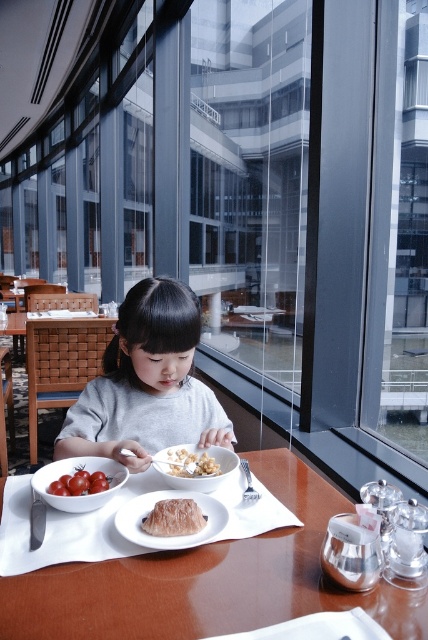
The wooden table at center is located at coordinates point (208, 580). If you were to place a new decorative vase on the table, where should you place it to ensure it doesn not obstruct the child eating from the bowl?

The wooden table at center is located at coordinates point (208, 580). To avoid obstructing the child eating from the bowl, the decorative vase should be placed in an area of the table not occupied by existing items like the bowl, plate, or silverware.

You are a food delivery person who needs to place a hot plate on the wooden table at center without touching the translucent gelatinous food at center. The plate is 6 inches in diameter. Is there enough space on the table to place the plate without it overlapping the food?

The wooden table at center is 7.06 inches away from the translucent gelatinous food at center. Since the plate is 6 inches in diameter, the distance between the table and the food is sufficient to place the plate without overlapping, as 7.06 inches is greater than half the plate diameter plus the food radius. However, precise placement is needed to ensure the plate stays clear of the food.

You are a server in a restaurant and need to place a new dish on the table. The dish is 10 cm tall. Can you safely place it on the wooden table at center without it touching the translucent gelatinous food at center?

The wooden table at center has a greater height compared to the translucent gelatinous food at center, so placing a dish 10 cm tall on the wooden table at center would not cause it to touch the translucent gelatinous food at center as long as the dish is placed properly.